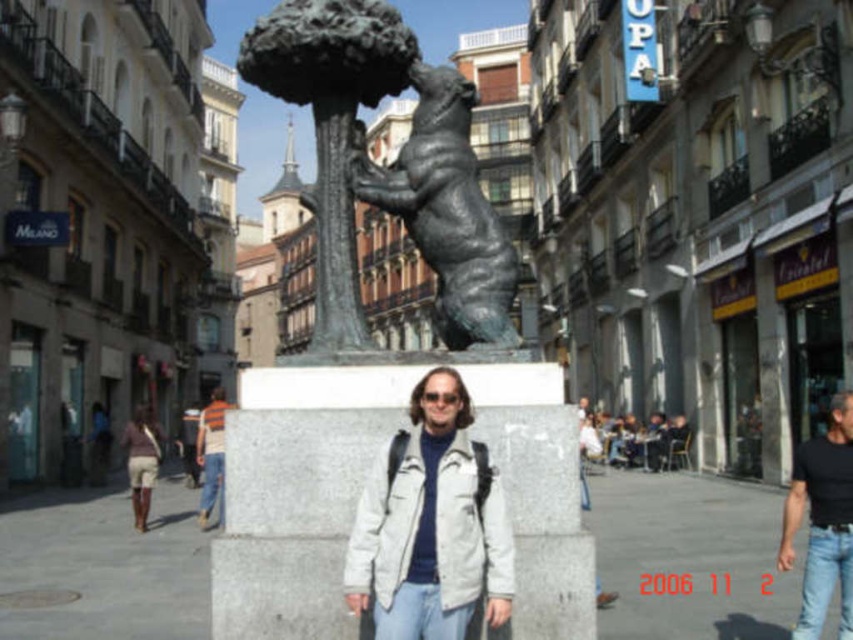
You are a photographer trying to capture a photo of the bronze bear at center and the beige shorts at lower left in the same frame. Based on their sizes, which object should you focus on first to ensure both are in the frame?

The bronze bear at center is taller than beige shorts at lower left, so you should focus on the bronze bear at center first to ensure both are in the frame.

You are a photographer trying to capture both the black cotton shirt at lower right and the beige shorts at lower left in the same frame. Based on their positions, which one is on the left side of the photo?

The beige shorts at lower left are on the left side of the photo because the black cotton shirt at lower right is positioned to the right of them.

You are a photographer trying to capture the bronze bear at center and the beige shorts at lower left in the same frame. Based on their positions, which object is positioned closer to the camera?

The bronze bear at center is closer to the viewer than the beige shorts at lower left, so it will appear larger and more prominent in the photo.